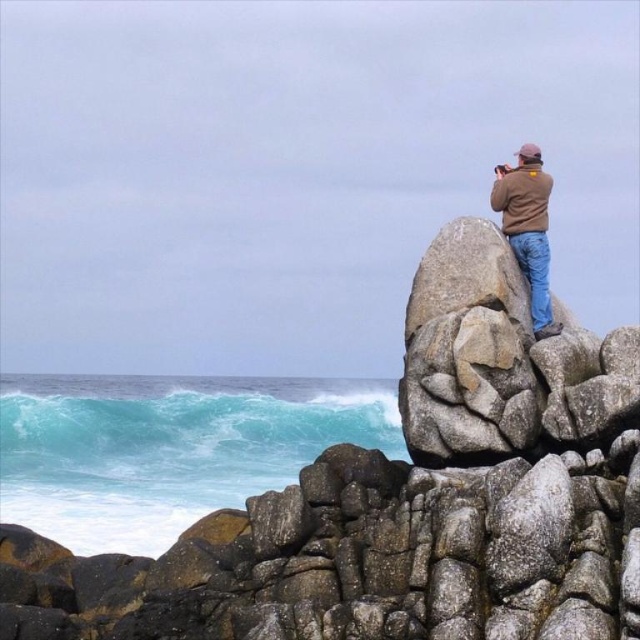
You are a photographer planning to capture a landscape shot that includes both the granite boulder at upper right and the blue denim jeans at upper right. Based on their sizes, which object should you position closer to the center of the frame to ensure both fit within the shot?

Since the granite boulder at upper right is wider than the blue denim jeans at upper right, you should position the granite boulder at upper right closer to the center of the frame to ensure both fit within the shot.

You are standing at the base of the cliff and want to reach the granite boulder at upper right. If your average walking speed is 3 feet per second, how many seconds will it take you to reach the boulder?

The granite boulder at upper right is 83.61 feet away from the viewer. At a walking speed of 3 feet per second, it would take approximately 27.87 seconds to reach it.